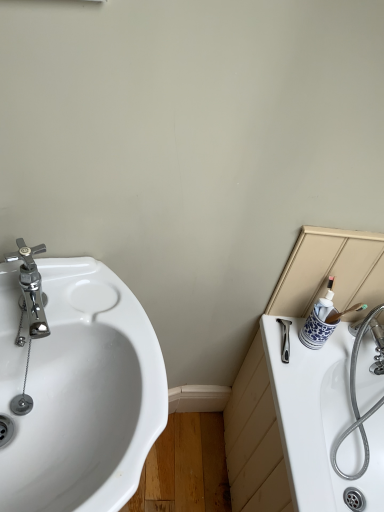
The image size is (384, 512). What do you see at coordinates (319, 418) in the screenshot? I see `white ceramic bath at right` at bounding box center [319, 418].

What do you see at coordinates (31, 287) in the screenshot? This screenshot has height=512, width=384. I see `chrome/metallic faucet at left` at bounding box center [31, 287].

Where is `chrome/metallic faucet at left`? This screenshot has height=512, width=384. chrome/metallic faucet at left is located at coordinates (31, 287).

Image resolution: width=384 pixels, height=512 pixels. In order to click on white ceramic bath at right in this screenshot , I will do `click(319, 418)`.

Who is smaller, white ceramic bath at right or white glossy sink at left?

white ceramic bath at right.

Between white ceramic bath at right and white glossy sink at left, which one appears on the right side from the viewer's perspective?

white ceramic bath at right is more to the right.

From a real-world perspective, is white ceramic bath at right physically below white glossy sink at left?

No, from a real-world perspective, white ceramic bath at right is not under white glossy sink at left.

Find the location of a particular element. bath behind the white glossy sink at left is located at coordinates (319, 418).

Considering the sizes of chrome/metallic faucet at left and white ceramic bath at right in the image, is chrome/metallic faucet at left bigger or smaller than white ceramic bath at right?

Considering their sizes, chrome/metallic faucet at left takes up less space than white ceramic bath at right.

Where is `tap on the left of white ceramic bath at right`? The width and height of the screenshot is (384, 512). tap on the left of white ceramic bath at right is located at coordinates (31, 287).

From the image's perspective, which one is positioned higher, chrome/metallic faucet at left or white ceramic bath at right?

chrome/metallic faucet at left.

Can you confirm if chrome/metallic faucet at left is thinner than white ceramic bath at right?

Indeed, chrome/metallic faucet at left has a lesser width compared to white ceramic bath at right.

From the image's perspective, is white ceramic bath at right above or below blue and white ceramic cup at right?

Based on their image positions, white ceramic bath at right is located beneath blue and white ceramic cup at right.

Can you see white ceramic bath at right touching blue and white ceramic cup at right?

No, white ceramic bath at right is not beside blue and white ceramic cup at right.

Considering the sizes of objects white ceramic bath at right and blue and white ceramic cup at right in the image provided, who is thinner, white ceramic bath at right or blue and white ceramic cup at right?

blue and white ceramic cup at right.

Considering the sizes of objects blue and white ceramic cup at right and white glossy sink at left in the image provided, who is thinner, blue and white ceramic cup at right or white glossy sink at left?

With smaller width is blue and white ceramic cup at right.

Based on the photo, is blue and white ceramic cup at right facing away from white glossy sink at left?

That's not correct — blue and white ceramic cup at right is not looking away from white glossy sink at left.

Can white glossy sink at left be found inside blue and white ceramic cup at right?

No, white glossy sink at left is located outside of blue and white ceramic cup at right.

From the image's perspective, who appears lower, blue and white ceramic cup at right or white glossy sink at left?

white glossy sink at left, from the image's perspective.

Considering the points (126, 379) and (25, 258), which point is in front, point (126, 379) or point (25, 258)?

The point (126, 379) is closer.

From the image's perspective, relative to chrome/metallic faucet at left, is white glossy sink at left above or below?

Clearly, from the image's perspective, white glossy sink at left is below chrome/metallic faucet at left.

Do you think white glossy sink at left is within chrome/metallic faucet at left, or outside of it?

white glossy sink at left is not enclosed by chrome/metallic faucet at left.

From a real-world perspective, who is located higher, white glossy sink at left or chrome/metallic faucet at left?

chrome/metallic faucet at left is physically above.

Between blue and white ceramic cup at right and chrome/metallic faucet at left, which one has larger width?

chrome/metallic faucet at left.

Can you confirm if blue and white ceramic cup at right is smaller than chrome/metallic faucet at left?

Actually, blue and white ceramic cup at right might be larger than chrome/metallic faucet at left.

Does blue and white ceramic cup at right appear on the left side of chrome/metallic faucet at left?

No.

How different are the orientations of blue and white ceramic cup at right and chrome/metallic faucet at left in degrees?

There is a 23.5-degree angle between the facing directions of blue and white ceramic cup at right and chrome/metallic faucet at left.

Is white glossy sink at left touching blue and white ceramic cup at right?

No, white glossy sink at left is not with blue and white ceramic cup at right.

Can we say white glossy sink at left lies outside blue and white ceramic cup at right?

That's correct, white glossy sink at left is outside of blue and white ceramic cup at right.

Considering the relative sizes of white glossy sink at left and blue and white ceramic cup at right in the image provided, is white glossy sink at left thinner than blue and white ceramic cup at right?

In fact, white glossy sink at left might be wider than blue and white ceramic cup at right.

From a real-world perspective, is white glossy sink at left below blue and white ceramic cup at right?

Yes, from a real-world perspective, white glossy sink at left is under blue and white ceramic cup at right.

This screenshot has width=384, height=512. In order to click on bath on the right side of white glossy sink at left in this screenshot , I will do `click(319, 418)`.

Find the location of `tap above the white ceramic bath at right (from the image's perspective)`. tap above the white ceramic bath at right (from the image's perspective) is located at coordinates (31, 287).

Looking at the image, which one is located closer to chrome/metallic faucet at left, blue and white ceramic cup at right or white ceramic bath at right?

blue and white ceramic cup at right lies closer to chrome/metallic faucet at left than the other object.

Considering their positions, is chrome/metallic faucet at left positioned closer to white ceramic bath at right than white glossy sink at left?

Among the two, white glossy sink at left is located nearer to white ceramic bath at right.

When comparing their distances from white ceramic bath at right, does blue and white ceramic cup at right or white glossy sink at left seem closer?

The object closer to white ceramic bath at right is blue and white ceramic cup at right.

When comparing their distances from white glossy sink at left, does blue and white ceramic cup at right or chrome/metallic faucet at left seem further?

Based on the image, blue and white ceramic cup at right appears to be further to white glossy sink at left.

Based on their spatial positions, is white glossy sink at left or chrome/metallic faucet at left closer to blue and white ceramic cup at right?

Based on the image, white glossy sink at left appears to be nearer to blue and white ceramic cup at right.

When comparing their distances from white glossy sink at left, does chrome/metallic faucet at left or white ceramic bath at right seem closer?

Among the two, chrome/metallic faucet at left is located nearer to white glossy sink at left.

Which object lies nearer to the anchor point white glossy sink at left, chrome/metallic faucet at left or blue and white ceramic cup at right?

chrome/metallic faucet at left is closer to white glossy sink at left.

Estimate the real-world distances between objects in this image. Which object is closer to white ceramic bath at right, blue and white ceramic cup at right or chrome/metallic faucet at left?

Based on the image, blue and white ceramic cup at right appears to be nearer to white ceramic bath at right.

Identify the location of toiletry between chrome/metallic faucet at left and white ceramic bath at right. (320, 321).

I want to click on sink situated between chrome/metallic faucet at left and white ceramic bath at right from left to right, so click(79, 391).

Find the location of `sink located between chrome/metallic faucet at left and blue and white ceramic cup at right in the left-right direction`. sink located between chrome/metallic faucet at left and blue and white ceramic cup at right in the left-right direction is located at coordinates (79, 391).

Where is `toiletry between white glossy sink at left and white ceramic bath at right from left to right`? toiletry between white glossy sink at left and white ceramic bath at right from left to right is located at coordinates 320,321.